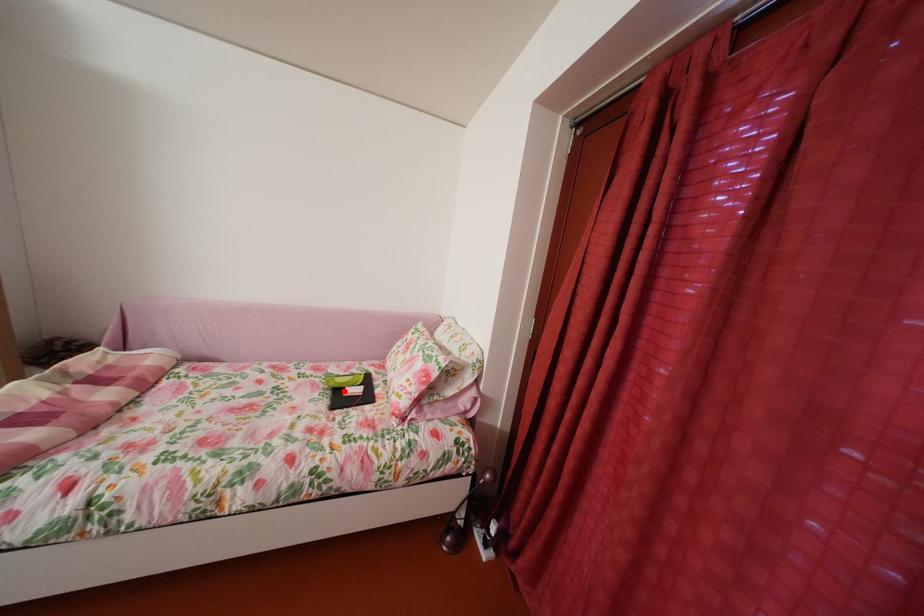
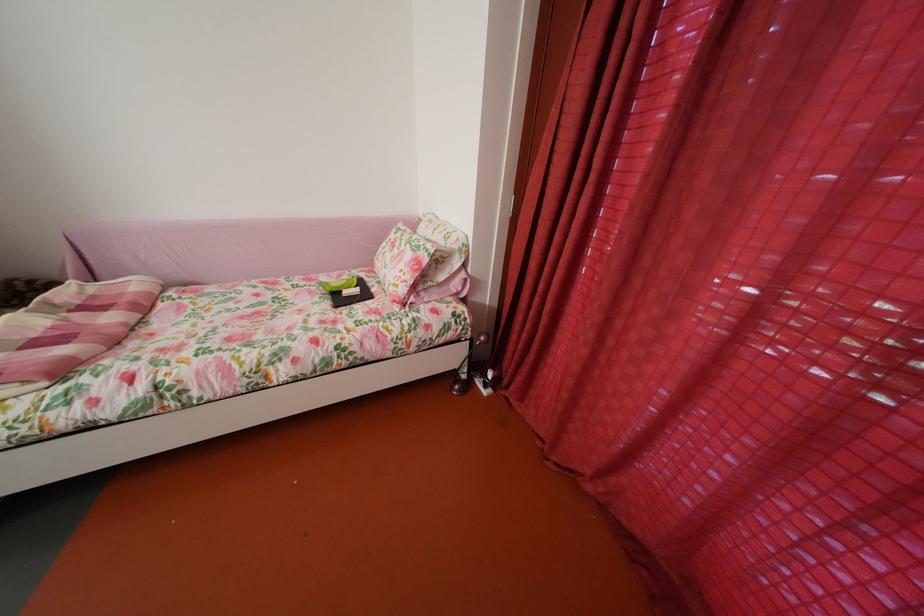
Find the pixel in the second image that matches the highlighted location in the first image.

(341, 296)